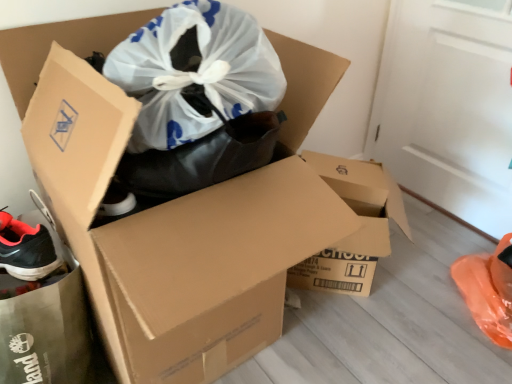
At what (x,y) coordinates should I click in order to perform the action: click on free space to the right of brown cardboard box at center, the 1th box viewed from the right. Please return your answer as a coordinate pair (x, y). Looking at the image, I should click on (433, 293).